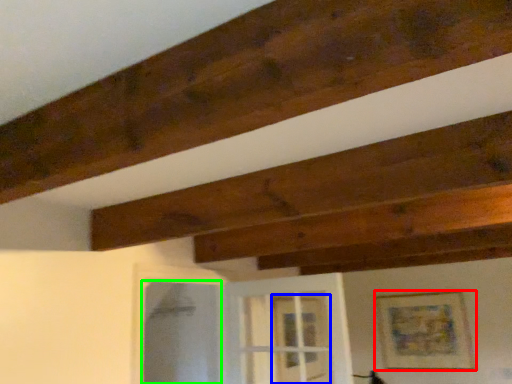
Question: Estimate the real-world distances between objects in this image. Which object is closer to picture frame (highlighted by a red box), glass door (highlighted by a blue box) or screen door (highlighted by a green box)?

Choices:
 (A) glass door
 (B) screen door

Answer: (A)